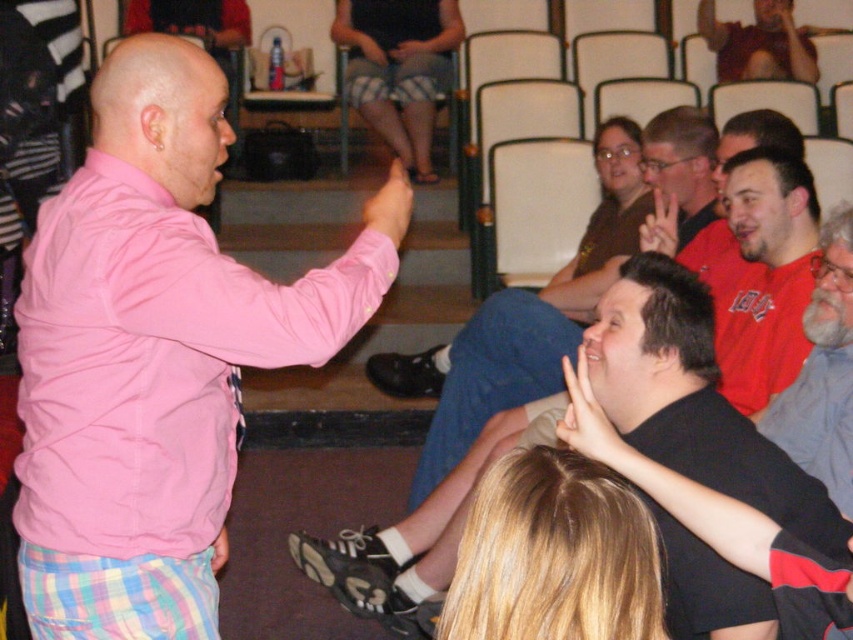
Is matte red shirt at upper right wider than white matte hand at center?

Yes, matte red shirt at upper right is wider than white matte hand at center.

Which is behind, point (732, 51) or point (647, 236)?

The point (732, 51) is more distant.

You are a GUI agent. You are given a task and a screenshot of the screen. Output one action in this format:
    pyautogui.click(x=<x>, y=<y>)
    Task: Click on the matte red shirt at upper right
    Image resolution: width=853 pixels, height=640 pixels.
    Given the screenshot: What is the action you would take?
    pyautogui.click(x=758, y=44)

Can you confirm if matte red shirt at upper right is positioned below pink fabric pants at lower left?

Incorrect, matte red shirt at upper right is not positioned below pink fabric pants at lower left.

Is matte red shirt at upper right positioned in front of pink fabric pants at lower left?

No, matte red shirt at upper right is further to the viewer.

Locate an element on the screen. The height and width of the screenshot is (640, 853). matte red shirt at upper right is located at coordinates (758, 44).

Who is taller, matte red shirt at right or pink fabric pants at lower left?

Standing taller between the two is matte red shirt at right.

What are the coordinates of `matte red shirt at right` in the screenshot? It's located at 759,273.

Find the location of a particular element. This screenshot has height=640, width=853. matte red shirt at right is located at coordinates (759, 273).